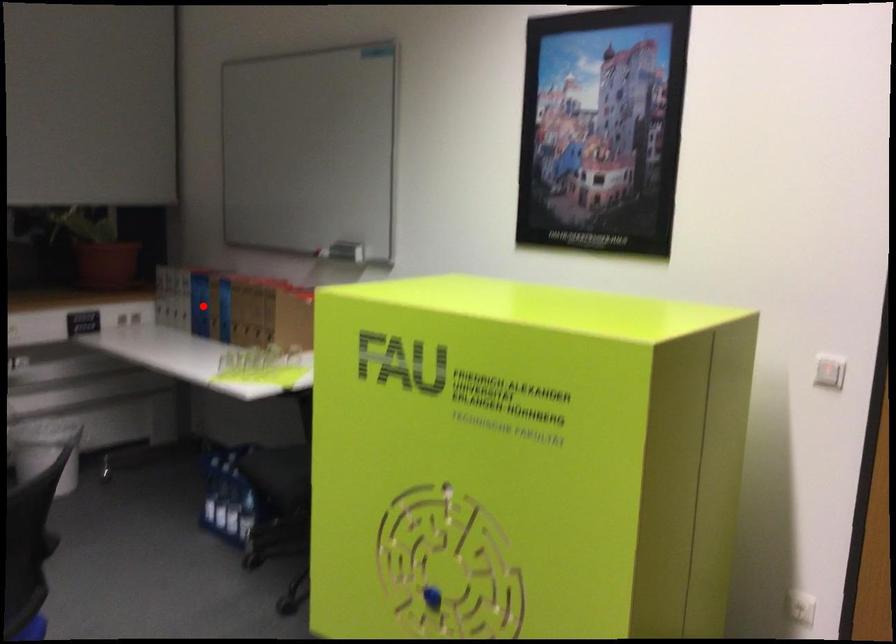
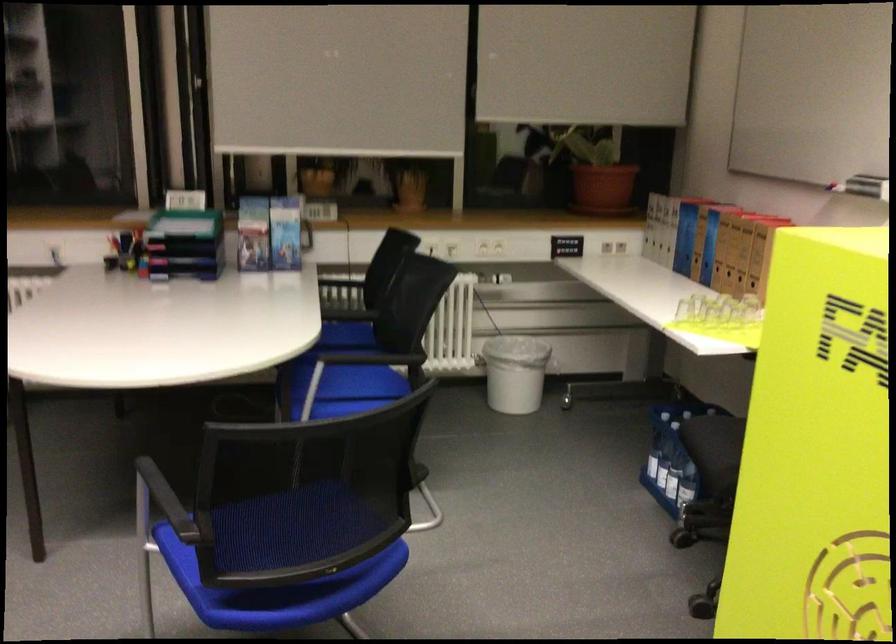
The point at the highlighted location is marked in the first image. Where is the corresponding point in the second image?

(685, 238)